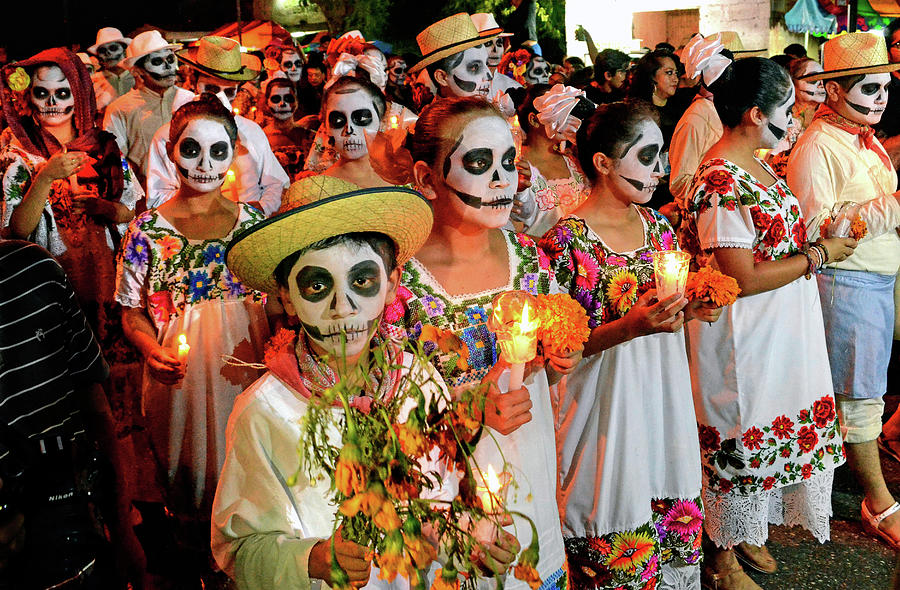
Locate an element on the screen. The width and height of the screenshot is (900, 590). candle flames is located at coordinates (526, 317), (672, 264), (177, 337).